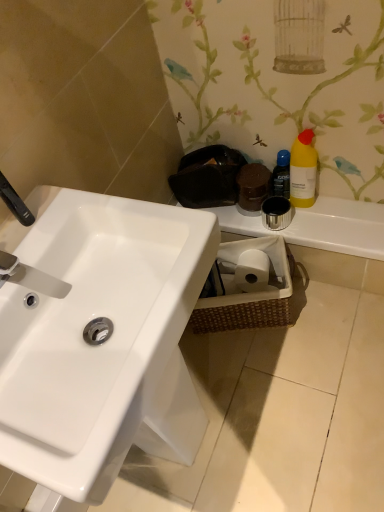
You are a GUI agent. You are given a task and a screenshot of the screen. Output one action in this format:
    pyautogui.click(x=<x>, y=<y>)
    Task: Click on the free spot in front of blue glossy bottle at upper right
    The height and width of the screenshot is (512, 384).
    Given the screenshot: What is the action you would take?
    pyautogui.click(x=327, y=222)